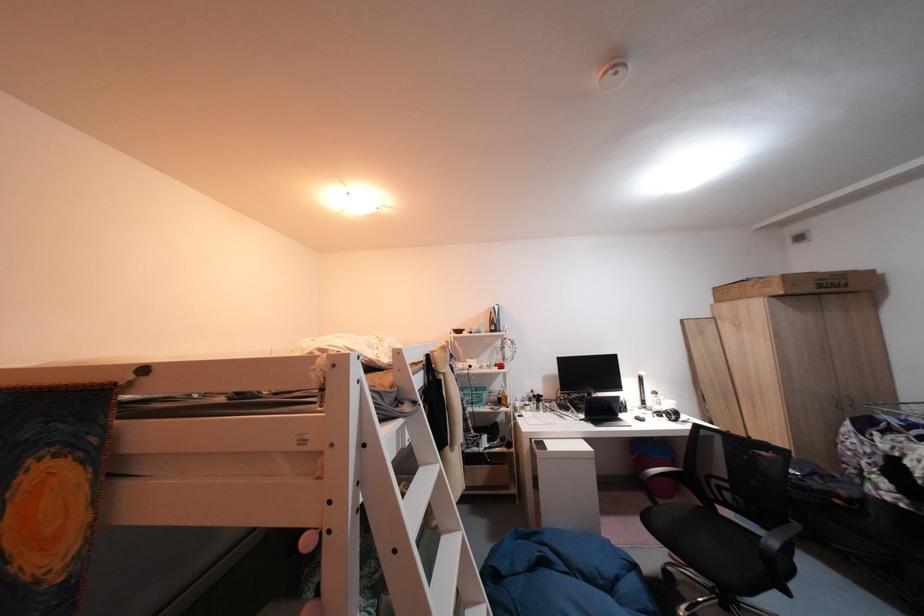
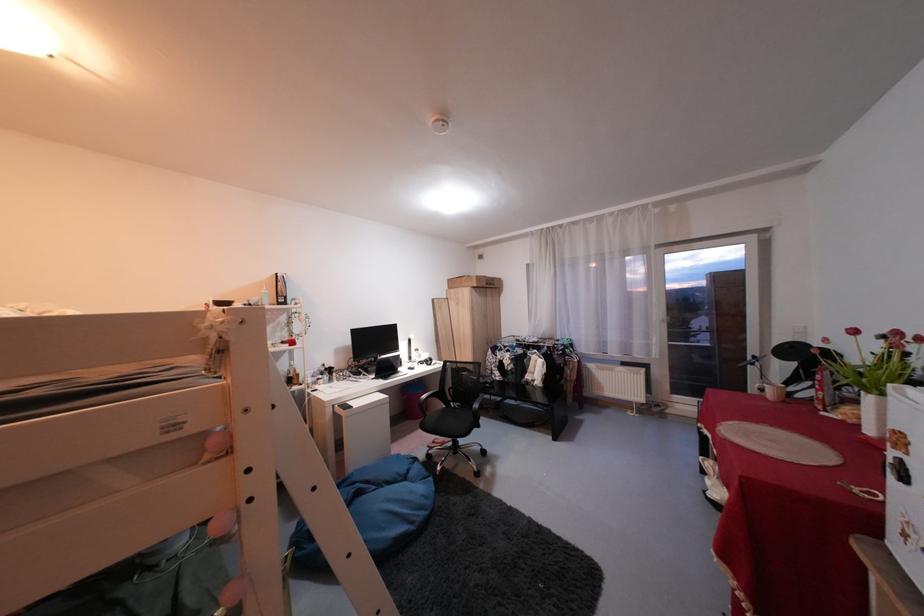
Question: How did the camera likely rotate?

Choices:
 (A) Left
 (B) Right
 (C) Up
 (D) Down

Answer: (B)